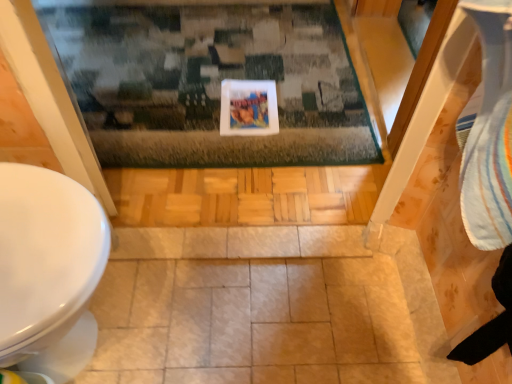
This screenshot has width=512, height=384. Identify the location of blank area beneath textured green rug at center (from a real-world perspective). (174, 78).